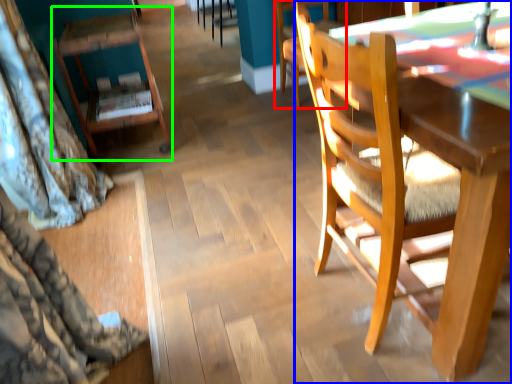
Question: Which object is the closest to the chair (highlighted by a red box)? Choose among these: chair (highlighted by a blue box) or chair (highlighted by a green box).

Choices:
 (A) chair
 (B) chair

Answer: (B)